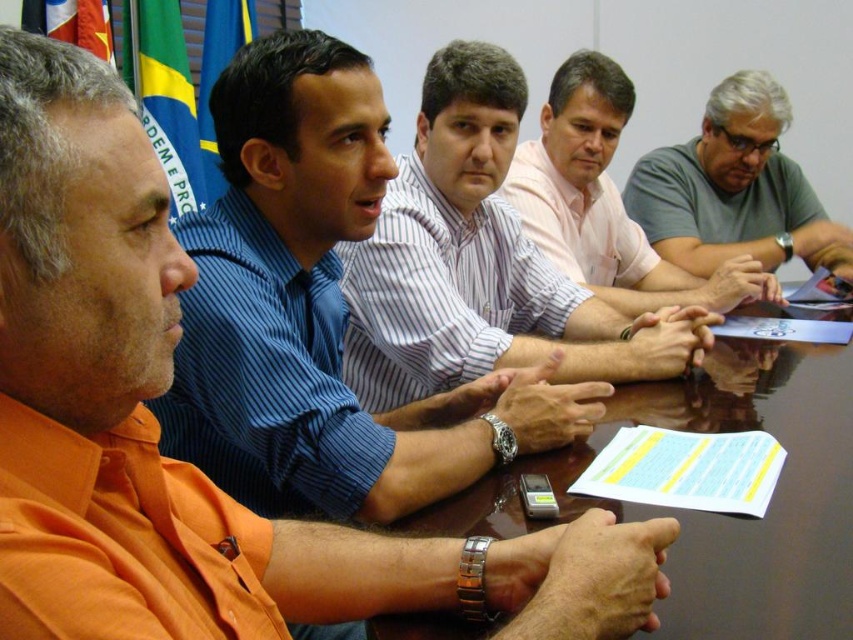
Question: Is white striped shirt at center positioned before gray cotton shirt at center?

Choices:
 (A) yes
 (B) no

Answer: (A)

Question: Can you confirm if glossy wooden table at center is bigger than gray cotton shirt at center?

Choices:
 (A) yes
 (B) no

Answer: (A)

Question: Observing the image, what is the correct spatial positioning of white striped shirt at center in reference to gray cotton shirt at center?

Choices:
 (A) below
 (B) above

Answer: (A)

Question: Among these objects, which one is nearest to the camera?

Choices:
 (A) gray cotton shirt at center
 (B) glossy wooden table at center
 (C) white striped shirt at center
 (D) gray matte shirt at upper right

Answer: (B)

Question: Estimate the real-world distances between objects in this image. Which object is closer to the gray cotton shirt at center?

Choices:
 (A) gray matte shirt at upper right
 (B) glossy wooden table at center
 (C) white striped shirt at center

Answer: (A)

Question: Which point is closer to the camera?

Choices:
 (A) (392, 627)
 (B) (552, 164)

Answer: (A)